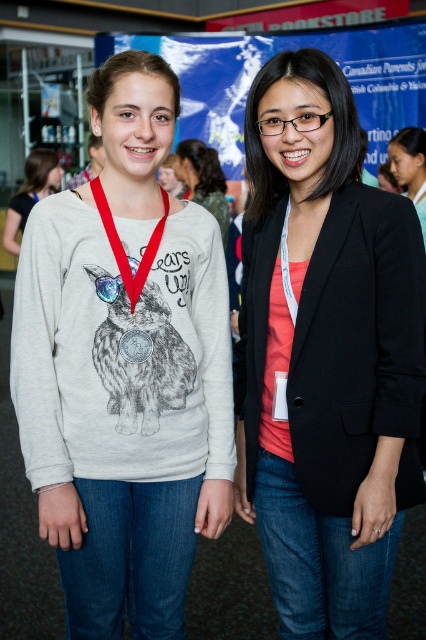
Question: Which of these objects is positioned farthest from the red fabric lanyard at center?

Choices:
 (A) gold metallic medal at center
 (B) matte gray sweatshirt with rabbit print at center
 (C) matte white neck at center

Answer: (B)

Question: Can you confirm if black matte blazer at center is positioned below matte white neck at center?

Choices:
 (A) yes
 (B) no

Answer: (A)

Question: Is matte silver medal at center bigger than red fabric lanyard at center?

Choices:
 (A) yes
 (B) no

Answer: (A)

Question: Among these points, which one is nearest to the camera?

Choices:
 (A) 97,208
 (B) 32,180
 (C) 121,611
 (D) 126,356

Answer: (D)

Question: Is red fabric lanyard at center to the left of matte black blazer at center from the viewer's perspective?

Choices:
 (A) no
 (B) yes

Answer: (B)

Question: Which point is farther to the camera?

Choices:
 (A) red fabric lanyard at center
 (B) white matte sweatshirt at center
 (C) black matte blazer at center

Answer: (B)